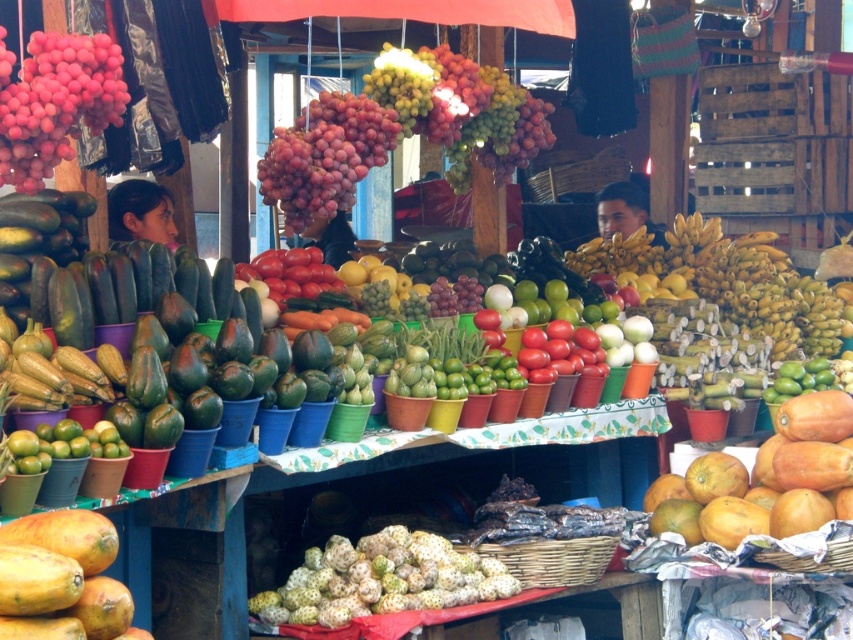
You are standing in the fruit market and want to find the shiny red grapes at center. According to the image coordinates, where exactly are they located?

The shiny red grapes at center are located at the coordinates point (325, 156).

You are a customer at the fruit market and want to pick up both the matte green papaya at left and the shiny red tomatoes at center. How far apart are these two items from each other?

The distance between the matte green papaya at left and the shiny red tomatoes at center is 8.98 feet.

You are a customer standing at the entrance of the fruit market. You see the matte green papaya at left. Can you reach it without moving closer?

The matte green papaya at left is 24.45 feet away from the camera, so you cannot reach it without moving closer.